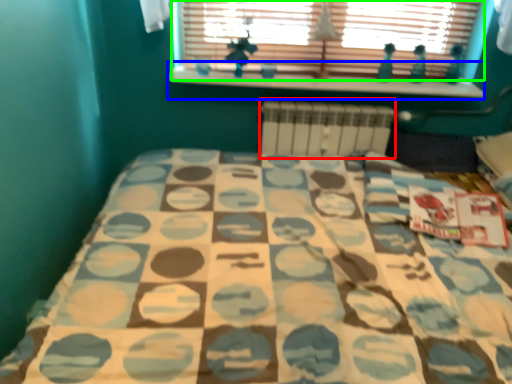
Question: Which object is positioned farthest from radiator (highlighted by a red box)? Select from window sill (highlighted by a blue box) and window (highlighted by a green box).

Choices:
 (A) window sill
 (B) window

Answer: (B)